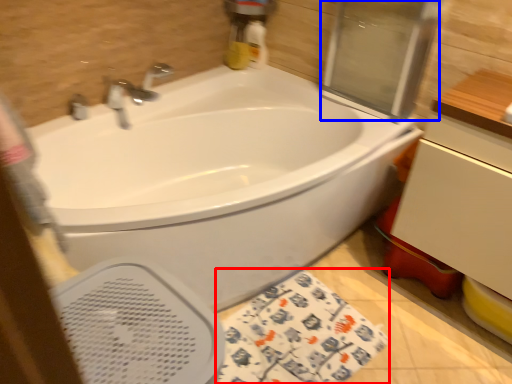
Question: Among these objects, which one is nearest to the camera, beach towel (highlighted by a red box) or screen door (highlighted by a blue box)?

Choices:
 (A) beach towel
 (B) screen door

Answer: (A)